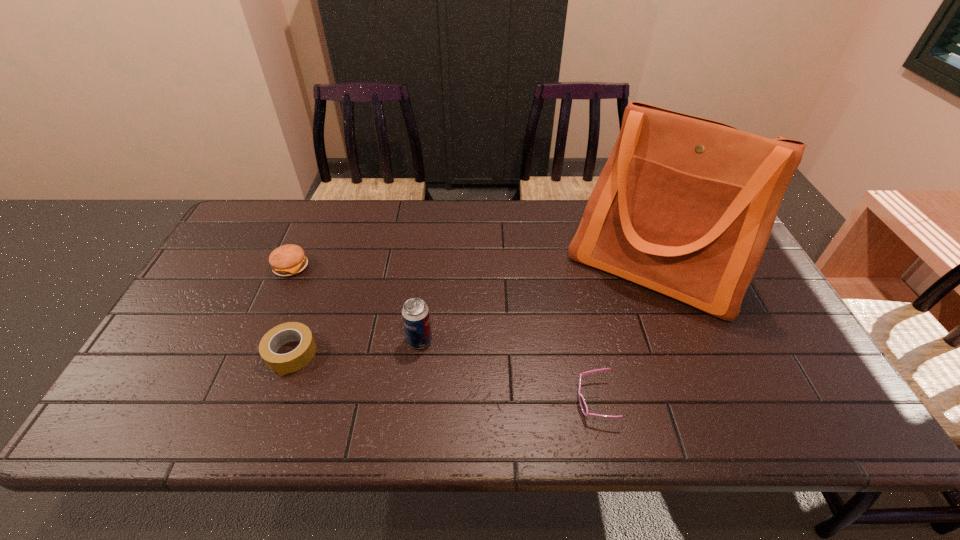
Locate an element on the screen. free spot between the third object from right to left and the nearest object is located at coordinates (507, 370).

Where is `free space between the fourth shortest object and the duct tape`? free space between the fourth shortest object and the duct tape is located at coordinates (355, 347).

Locate an element on the screen. The height and width of the screenshot is (540, 960). the third closest object relative to the hamburger is located at coordinates (684, 206).

The width and height of the screenshot is (960, 540). Identify the location of object that ranks as the third closest to the duct tape. (583, 405).

Locate an element on the screen. The image size is (960, 540). vacant space that satisfies the following two spatial constraints: 1. on the front side of the third tallest object; 2. on the right side of the beer can is located at coordinates [258, 340].